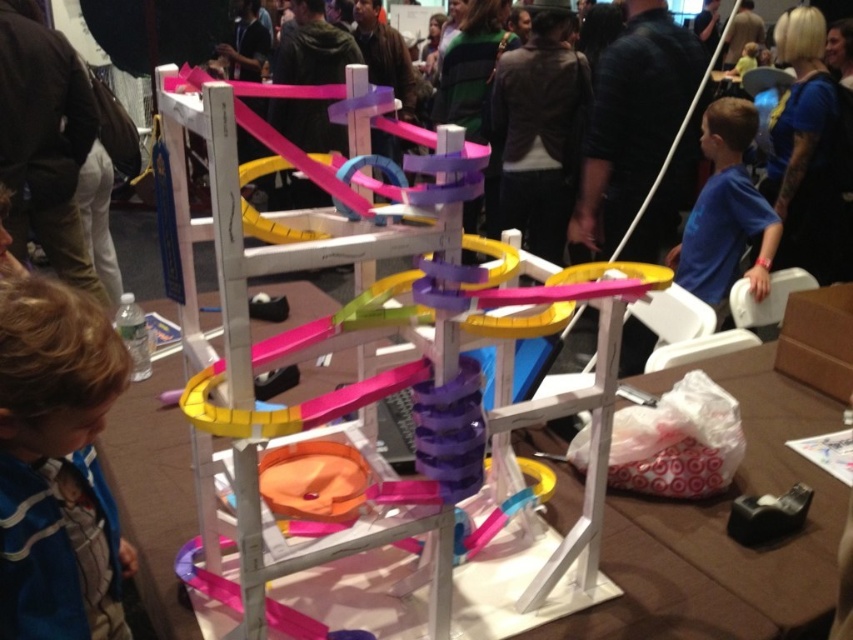
You are standing in front of a marble run setup at a public event. You notice two points marked on the tracks labeled as point (x=556, y=291) and point (x=752, y=120). If you want to place a sticker closer to the camera, which point should you choose?

Point (x=556, y=291) is closer to the camera than point (x=752, y=120), so you should place the sticker on point (x=556, y=291).

You are a child trying to place a marble into the translucent plastic track at center while wearing a blue striped shirt at lower left. Can you fit the marble into the track without the shirt interfering?

The translucent plastic track at center is wider than the blue striped shirt at lower left, so the marble can be placed into the track without interference from the shirt.